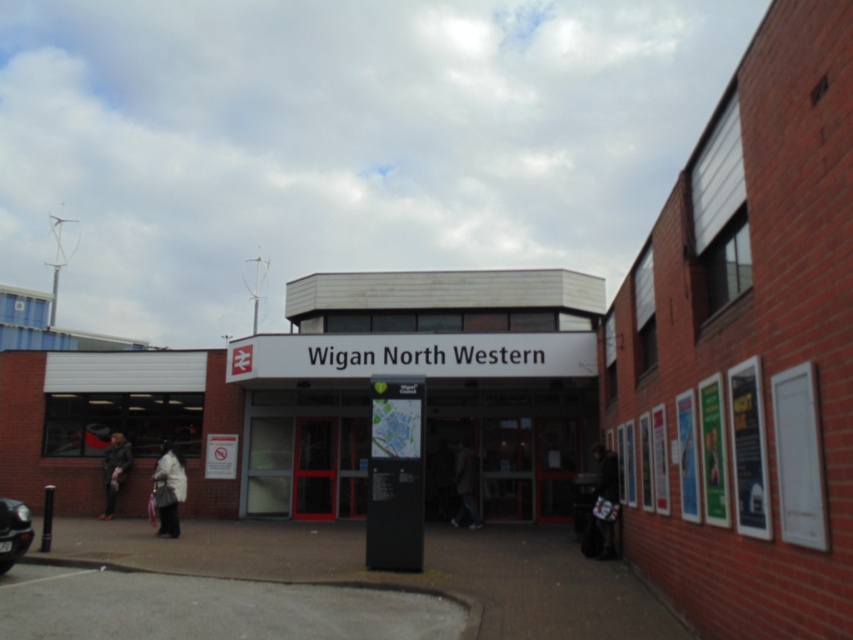
Is shiny black car at lower left further to the viewer compared to dark gray jacket at center?

No, shiny black car at lower left is closer to the viewer.

Based on the photo, does shiny black car at lower left have a lesser width compared to dark gray jacket at center?

Indeed, shiny black car at lower left has a lesser width compared to dark gray jacket at center.

Who is more distant from viewer, (13, 513) or (463, 509)?

Positioned behind is point (463, 509).

What are the coordinates of `shiny black car at lower left` in the screenshot? It's located at (13, 531).

Does dark gray fabric coat at right appear over dark gray coat at lower left?

Yes.

Which is behind, point (599, 444) or point (119, 464)?

The point (119, 464) is more distant.

Identify the location of dark gray fabric coat at right. The height and width of the screenshot is (640, 853). (606, 474).

Based on the photo, can you confirm if white fabric coat at lower left is shorter than dark gray jacket at center?

Correct, white fabric coat at lower left is not as tall as dark gray jacket at center.

Looking at this image, is white fabric coat at lower left to the left of dark gray jacket at center from the viewer's perspective?

Yes, white fabric coat at lower left is to the left of dark gray jacket at center.

Which is in front, point (171, 525) or point (460, 497)?

Point (171, 525) is more forward.

This screenshot has height=640, width=853. Find the location of `white fabric coat at lower left`. white fabric coat at lower left is located at coordinates (169, 488).